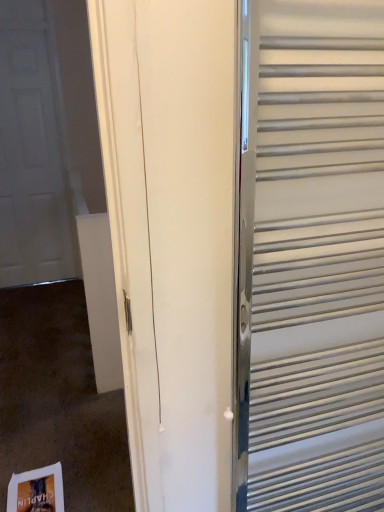
Describe the element at coordinates (33, 151) in the screenshot. Image resolution: width=384 pixels, height=512 pixels. I see `white matte door at left` at that location.

What is the approximate width of white matte door at left?

The width of white matte door at left is 3.19 inches.

The height and width of the screenshot is (512, 384). I want to click on white matte door at left, so click(33, 151).

In the scene shown: What is the approximate height of white matte door at left?

white matte door at left is 6.32 feet tall.

What do you see at coordinates (313, 258) in the screenshot?
I see `metallic silver elevator at right` at bounding box center [313, 258].

Where is `metallic silver elevator at right`? This screenshot has width=384, height=512. metallic silver elevator at right is located at coordinates (x=313, y=258).

Where is `white matte door at left`? white matte door at left is located at coordinates (33, 151).

In the image, is white matte door at left on the left side or the right side of metallic silver elevator at right?

white matte door at left is to the left of metallic silver elevator at right.

Which object is further away from the camera, white matte door at left or metallic silver elevator at right?

Positioned behind is white matte door at left.

Which is farther from the camera, [26,266] or [312,200]?

The point [26,266] is behind.

From the image's perspective, does white matte door at left appear higher than metallic silver elevator at right?

Yes, from the image's perspective, white matte door at left is over metallic silver elevator at right.

From a real-world perspective, is white matte door at left positioned above or below metallic silver elevator at right?

In terms of real-world spatial position, white matte door at left is above metallic silver elevator at right.

Between white matte door at left and metallic silver elevator at right, which one has smaller width?

With smaller width is white matte door at left.

Who is shorter, white matte door at left or metallic silver elevator at right?

metallic silver elevator at right is shorter.

Considering the sizes of white matte door at left and metallic silver elevator at right in the image, is white matte door at left bigger or smaller than metallic silver elevator at right?

Clearly, white matte door at left is larger in size than metallic silver elevator at right.

Is white matte door at left not inside metallic silver elevator at right?

Yes, white matte door at left is located beyond the bounds of metallic silver elevator at right.

Are white matte door at left and metallic silver elevator at right far apart?

That's right, there is a large distance between white matte door at left and metallic silver elevator at right.

Consider the image. Is white matte door at left turned away from metallic silver elevator at right?

No, white matte door at left is not facing the opposite direction of metallic silver elevator at right.

Can you tell me how much white matte door at left and metallic silver elevator at right differ in facing direction?

There is a 0.00738-degree angle between the facing directions of white matte door at left and metallic silver elevator at right.

You are a GUI agent. You are given a task and a screenshot of the screen. Output one action in this format:
    pyautogui.click(x=<x>, y=<y>)
    Task: Click on the elevator that appears on the right of white matte door at left
    The width and height of the screenshot is (384, 512).
    Given the screenshot: What is the action you would take?
    pyautogui.click(x=313, y=258)

In the image, is metallic silver elevator at right on the left side or the right side of white matte door at left?

Clearly, metallic silver elevator at right is on the right of white matte door at left in the image.

Considering the relative positions of metallic silver elevator at right and white matte door at left in the image provided, is metallic silver elevator at right behind white matte door at left?

No, metallic silver elevator at right is in front of white matte door at left.

Is point (361, 458) closer or farther from the camera than point (38, 99)?

Point (361, 458).

From the image's perspective, is metallic silver elevator at right under white matte door at left?

Yes, from the image's perspective, metallic silver elevator at right is below white matte door at left.

From a real-world perspective, is metallic silver elevator at right physically above white matte door at left?

Actually, metallic silver elevator at right is physically below white matte door at left in the real world.

Between metallic silver elevator at right and white matte door at left, which one has smaller width?

Thinner between the two is white matte door at left.

Can you confirm if metallic silver elevator at right is shorter than white matte door at left?

Yes, metallic silver elevator at right is shorter than white matte door at left.

Which of these two, metallic silver elevator at right or white matte door at left, is bigger?

white matte door at left is bigger.

Is metallic silver elevator at right positioned beyond the bounds of white matte door at left?

Yes, metallic silver elevator at right is located beyond the bounds of white matte door at left.

From the picture: Is metallic silver elevator at right far from white matte door at left?

Yes, metallic silver elevator at right is far from white matte door at left.

Is metallic silver elevator at right oriented away from white matte door at left?

No, metallic silver elevator at right is not facing away from white matte door at left.

How many degrees apart are the facing directions of metallic silver elevator at right and white matte door at left?

0.00738 degrees separate the facing orientations of metallic silver elevator at right and white matte door at left.

Find the location of a particular element. elevator that is on the right side of white matte door at left is located at coordinates (313, 258).

Where is `elevator that is in front of the white matte door at left`? elevator that is in front of the white matte door at left is located at coordinates (313, 258).

I want to click on door to the left of metallic silver elevator at right, so click(x=33, y=151).